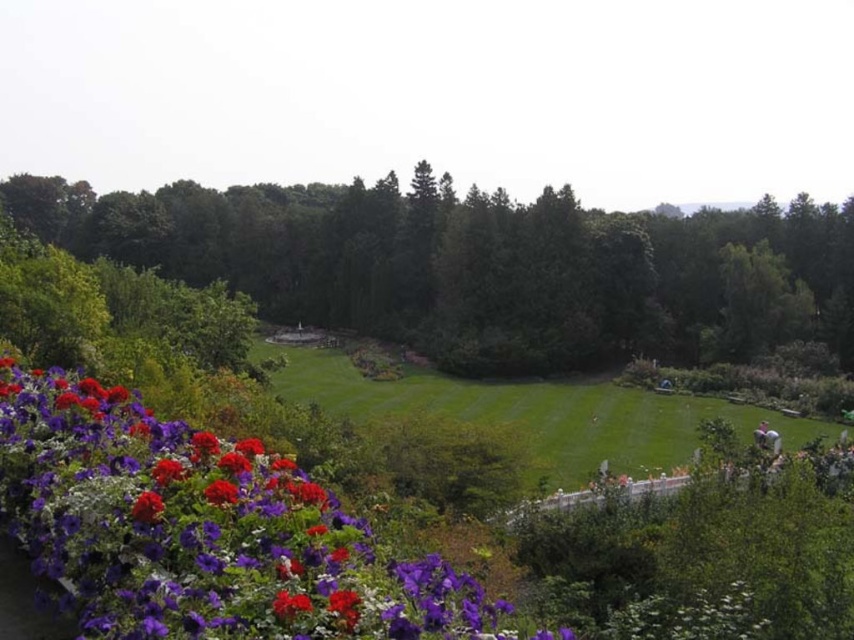
Is green leafy tree at left thinner than green grass at center?

No.

Can you confirm if green leafy tree at left is wider than green grass at center?

Correct, the width of green leafy tree at left exceeds that of green grass at center.

Who is more distant from viewer, (10, 205) or (578, 429)?

The point (10, 205) is more distant.

The width and height of the screenshot is (854, 640). What are the coordinates of `green leafy tree at left` in the screenshot? It's located at (466, 262).

In the scene shown: Is purple matte flower at lower left taller than green grass at center?

No, purple matte flower at lower left is not taller than green grass at center.

Between purple matte flower at lower left and green grass at center, which one is positioned higher?

purple matte flower at lower left is above.

You are a GUI agent. You are given a task and a screenshot of the screen. Output one action in this format:
    pyautogui.click(x=<x>, y=<y>)
    Task: Click on the purple matte flower at lower left
    
    Given the screenshot: What is the action you would take?
    pyautogui.click(x=202, y=531)

Is the position of green leafy tree at left more distant than that of purple matte flower at lower left?

Yes.

Is point (613, 214) farther from camera compared to point (279, 573)?

Yes, point (613, 214) is behind point (279, 573).

Image resolution: width=854 pixels, height=640 pixels. Describe the element at coordinates (466, 262) in the screenshot. I see `green leafy tree at left` at that location.

The image size is (854, 640). I want to click on green leafy tree at left, so click(x=466, y=262).